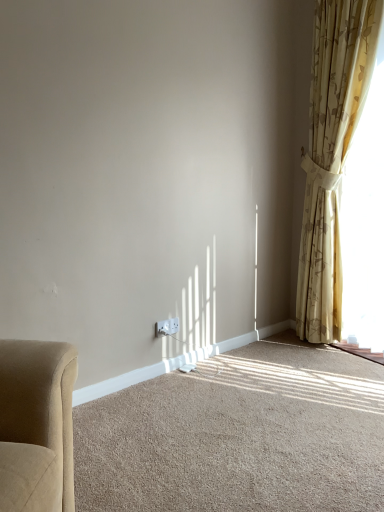
Question: In the image, is white plastic electric outlet at lower center on the left side or the right side of yellow floral curtain at right?

Choices:
 (A) left
 (B) right

Answer: (A)

Question: From a real-world perspective, relative to yellow floral curtain at right, is white plastic electric outlet at lower center vertically above or below?

Choices:
 (A) below
 (B) above

Answer: (A)

Question: Estimate the real-world distances between objects in this image. Which object is closer to the white plastic electric outlet at lower center?

Choices:
 (A) yellow floral curtain at right
 (B) beige carpet at lower center

Answer: (B)

Question: Based on their relative distances, which object is farther from the yellow floral curtain at right?

Choices:
 (A) white plastic electric outlet at lower center
 (B) beige carpet at lower center

Answer: (A)